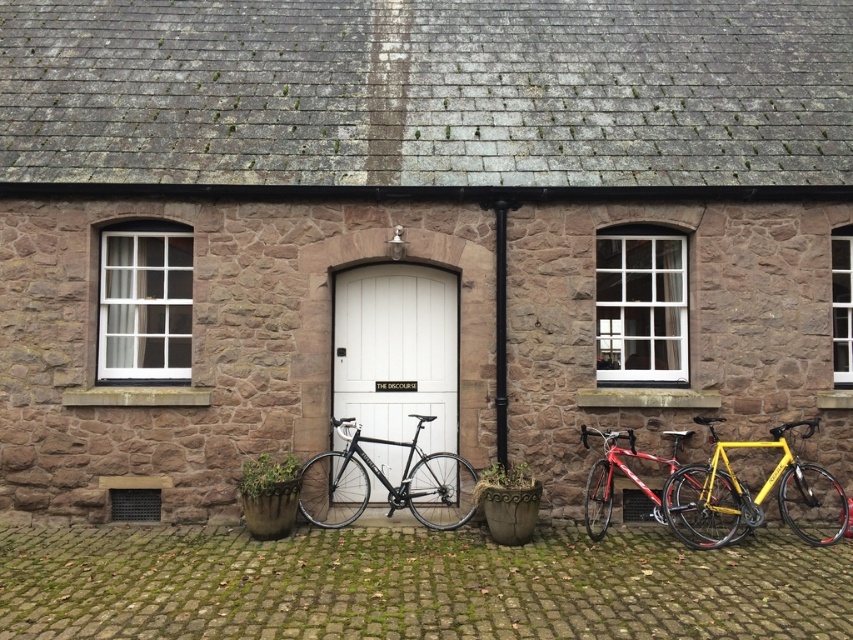
Does shiny black bike at center have a smaller size compared to shiny red bicycle at center?

Incorrect, shiny black bike at center is not smaller in size than shiny red bicycle at center.

Which is below, shiny black bike at center or shiny red bicycle at center?

shiny red bicycle at center is lower down.

Which is in front, point (454, 454) or point (602, 499)?

Positioned in front is point (602, 499).

Find the location of a particular element. shiny black bike at center is located at coordinates click(x=386, y=481).

Is yellow matte bicycle at right shorter than shiny red bicycle at center?

In fact, yellow matte bicycle at right may be taller than shiny red bicycle at center.

The image size is (853, 640). Describe the element at coordinates (751, 496) in the screenshot. I see `yellow matte bicycle at right` at that location.

Locate an element on the screen. Image resolution: width=853 pixels, height=640 pixels. yellow matte bicycle at right is located at coordinates [751, 496].

The height and width of the screenshot is (640, 853). Identify the location of yellow matte bicycle at right. (751, 496).

Does white matte door at center appear on the left side of shiny red bicycle at center?

Correct, you'll find white matte door at center to the left of shiny red bicycle at center.

Who is shorter, white matte door at center or shiny red bicycle at center?

With less height is shiny red bicycle at center.

Who is more distant from viewer, (x=370, y=371) or (x=621, y=468)?

Positioned behind is point (x=370, y=371).

Identify the location of white matte door at center. (x=396, y=352).